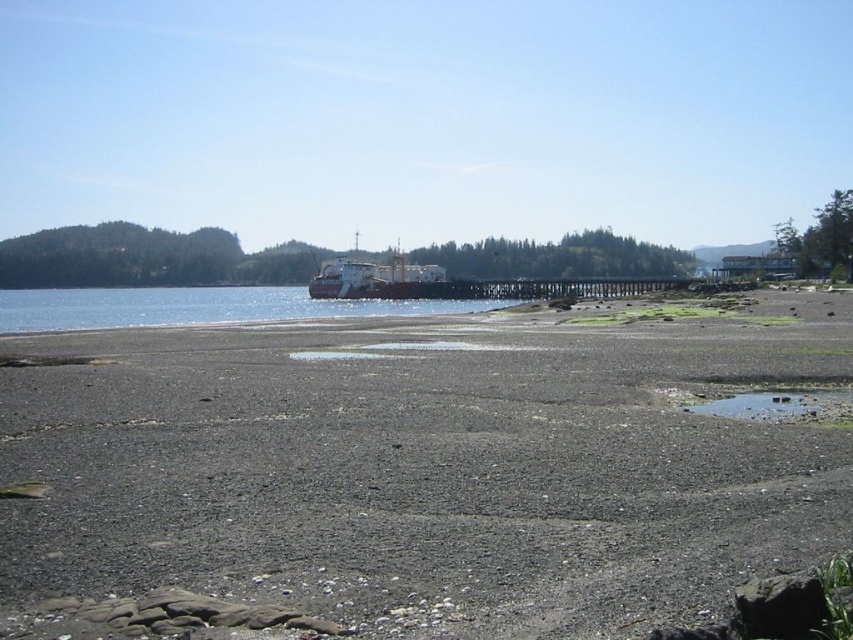
Question: Which of these objects is positioned farthest from the clear water at center?

Choices:
 (A) white matte cargo ship at center
 (B) gray gravelly sand at center

Answer: (B)

Question: Is the position of gray gravelly sand at center more distant than that of clear water at center?

Choices:
 (A) no
 (B) yes

Answer: (A)

Question: Which point appears farthest from the camera in this image?

Choices:
 (A) (79, 298)
 (B) (419, 296)

Answer: (A)

Question: Which of the following is the closest to the observer?

Choices:
 (A) (33, 326)
 (B) (401, 253)

Answer: (A)

Question: Does gray gravelly sand at center lie in front of white matte cargo ship at center?

Choices:
 (A) yes
 (B) no

Answer: (A)

Question: In this image, where is gray gravelly sand at center located relative to clear water at center?

Choices:
 (A) above
 (B) below

Answer: (B)